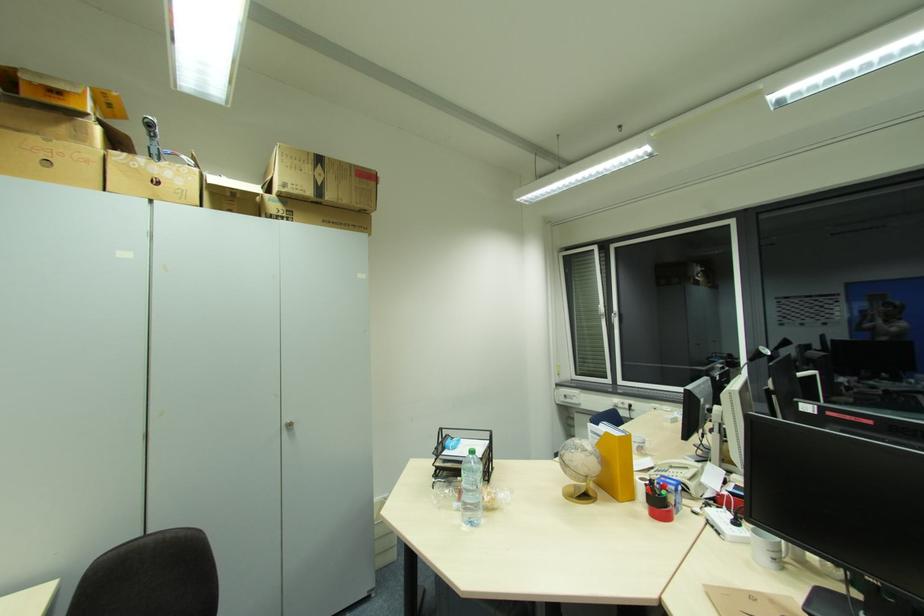
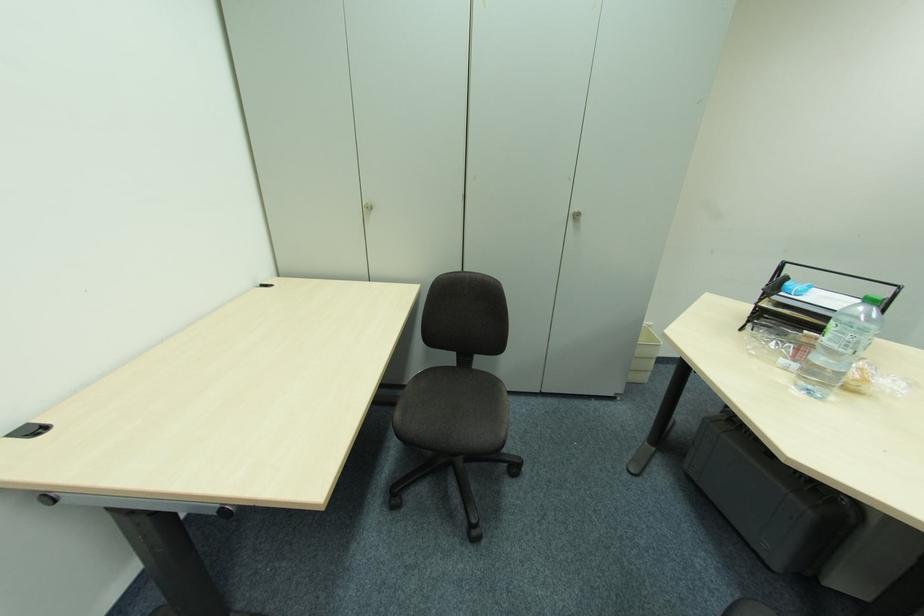
Question: I am providing you with two images of the same scene from different viewpoints. Which of the following objects are not visible in image2?

Choices:
 (A) green bottle cap
 (B) chair sitting surface
 (C) cabinet door handle
 (D) none of these

Answer: (D)